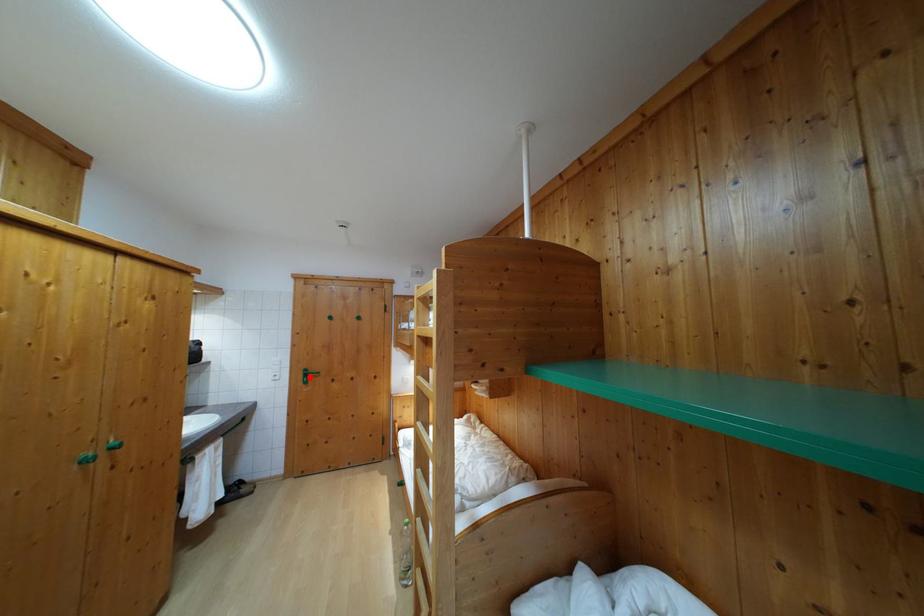
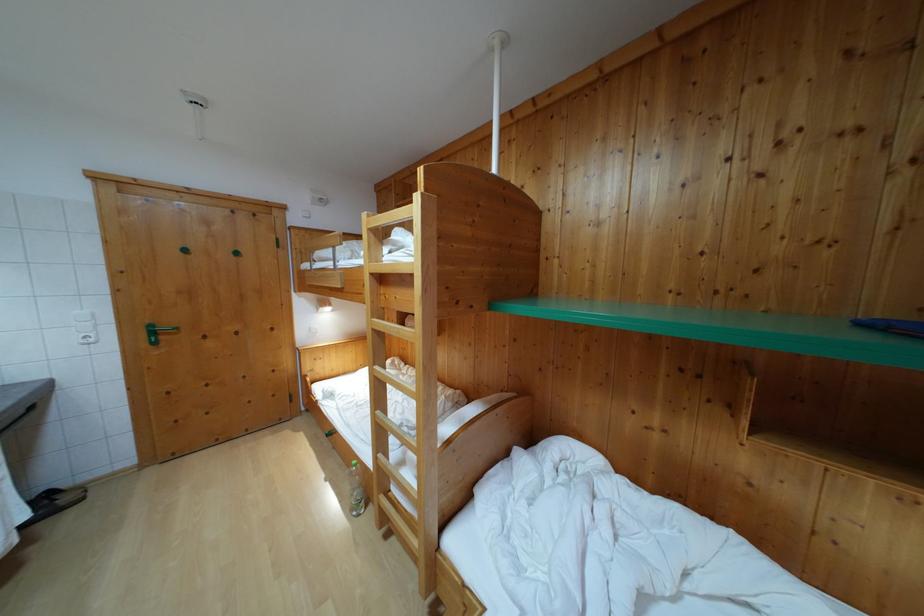
Question: I am providing you with two images of the same scene from different viewpoints. In image1, a red point is highlighted. Considering the same 3D point in image2, which of the following is correct?

Choices:
 (A) It is closer
 (B) It is farther

Answer: (A)